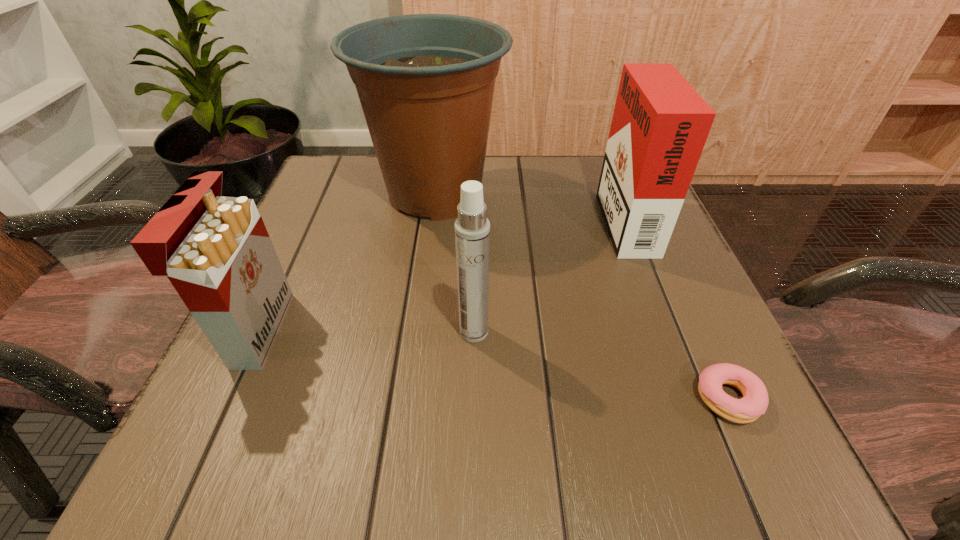
I want to click on vacant space at the near right corner of the desktop, so click(705, 455).

Locate an element on the screen. free space that is in between the left cigarette case and the flowerpot is located at coordinates (347, 262).

Where is `empty space between the flowerpot and the farther cigarette case`? The width and height of the screenshot is (960, 540). empty space between the flowerpot and the farther cigarette case is located at coordinates (529, 205).

The height and width of the screenshot is (540, 960). I want to click on empty location between the aerosol can and the shorter cigarette case, so click(x=366, y=331).

At what (x,y) coordinates should I click in order to perform the action: click on vacant region between the nearer cigarette case and the nearest object. Please return your answer as a coordinate pair (x, y). Looking at the image, I should click on (492, 364).

Where is `free space between the shorter cigarette case and the doughnut`? The width and height of the screenshot is (960, 540). free space between the shorter cigarette case and the doughnut is located at coordinates (492, 364).

Locate an element on the screen. The width and height of the screenshot is (960, 540). vacant area that lies between the leftmost object and the nearest object is located at coordinates (492, 364).

I want to click on free space between the flowerpot and the nearer cigarette case, so click(347, 262).

Where is `free space between the nearest object and the aerosol can`? This screenshot has width=960, height=540. free space between the nearest object and the aerosol can is located at coordinates (600, 365).

Identify the location of vacant point located between the flowerpot and the nearest object. The width and height of the screenshot is (960, 540). (581, 296).